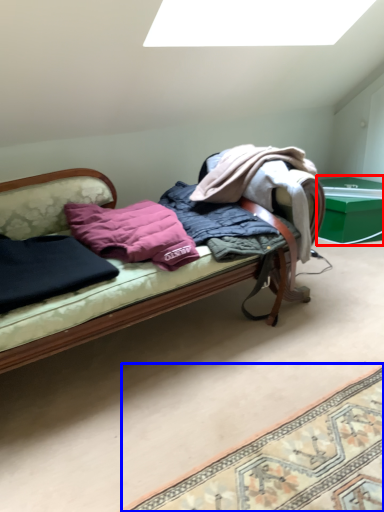
Question: Among these objects, which one is farthest to the camera, table (highlighted by a red box) or mat (highlighted by a blue box)?

Choices:
 (A) table
 (B) mat

Answer: (A)